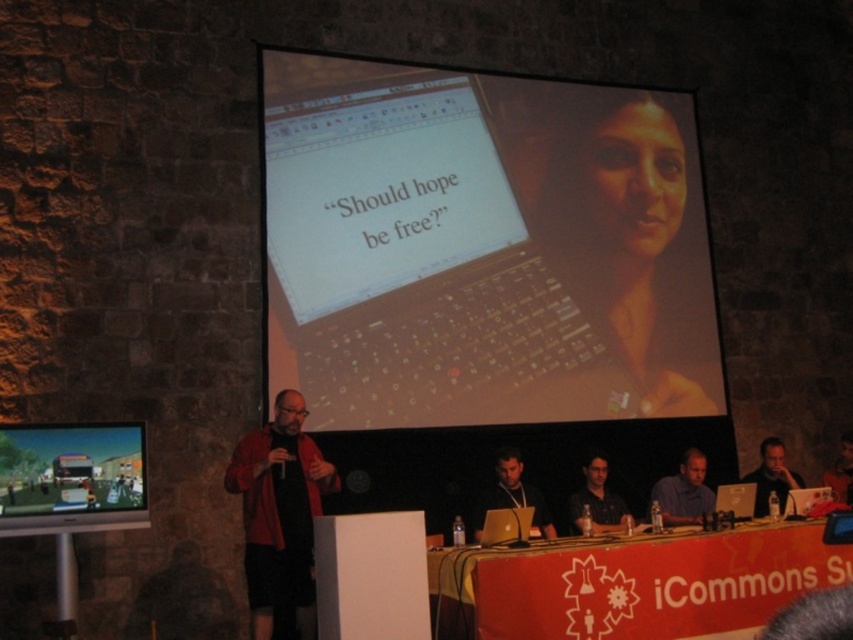
Can you confirm if red fabric banner at lower center is positioned to the right of blue shirt at center?

In fact, red fabric banner at lower center is to the left of blue shirt at center.

Is point (549, 625) positioned behind point (674, 486)?

That is False.

Locate an element on the screen. red fabric banner at lower center is located at coordinates (631, 584).

Which is more to the left, dark hair at center or blue shirt at center?

dark hair at center

Based on the photo, can you confirm if dark hair at center is positioned to the left of blue shirt at center?

Indeed, dark hair at center is positioned on the left side of blue shirt at center.

Between point (509, 454) and point (701, 493), which one is positioned behind?

Point (701, 493)

Locate an element on the screen. The width and height of the screenshot is (853, 640). dark hair at center is located at coordinates (512, 493).

Is matte black laptop at center positioned behind dark brown leather jacket at upper center?

Yes, it is.

What are the coordinates of `matte black laptop at center` in the screenshot? It's located at (480, 248).